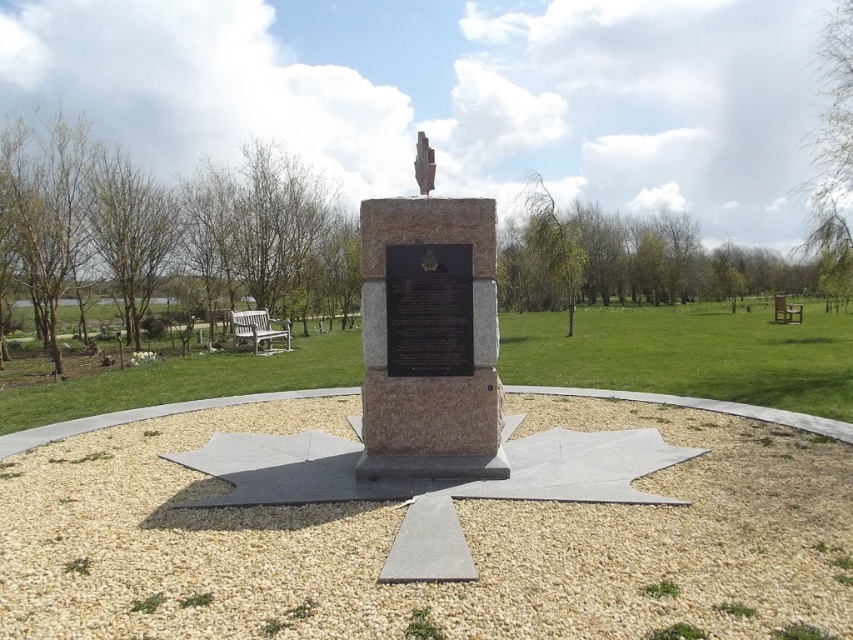
Question: Is gray gravel at center positioned before sculpture at center?

Choices:
 (A) yes
 (B) no

Answer: (A)

Question: Is gray gravel at center below sculpture at center?

Choices:
 (A) yes
 (B) no

Answer: (A)

Question: Which point is farther to the camera?

Choices:
 (A) sculpture at center
 (B) black polished stone plaque at center

Answer: (A)

Question: Does granite stone monument at center appear over white wooden bench at lower left?

Choices:
 (A) yes
 (B) no

Answer: (A)

Question: Which point is closer to the camera taking this photo?

Choices:
 (A) click(374, 536)
 (B) click(416, 173)
 (C) click(393, 323)
 (D) click(791, 314)

Answer: (A)

Question: Which object is closer to the camera taking this photo?

Choices:
 (A) black polished stone plaque at center
 (B) wooden park bench at right

Answer: (A)